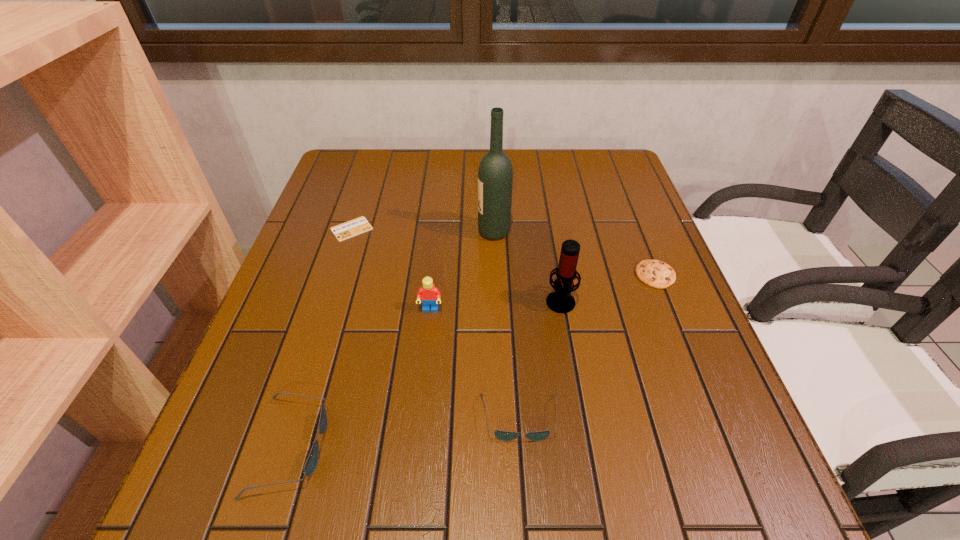
The width and height of the screenshot is (960, 540). What are the coordinates of `the taller sunglasses` in the screenshot? It's located at click(310, 466).

At what (x,y) coordinates should I click in order to perform the action: click on the fourth tallest object. Please return your answer as a coordinate pair (x, y). Looking at the image, I should click on (310, 466).

This screenshot has height=540, width=960. Identify the location of the shorter sunglasses. (505, 436).

You are a GUI agent. You are given a task and a screenshot of the screen. Output one action in this format:
    pyautogui.click(x=<x>, y=<y>)
    Task: Click on the right sunglasses
    
    Given the screenshot: What is the action you would take?
    pyautogui.click(x=505, y=436)

Find the location of a particular element. The image size is (960, 540). the tallest object is located at coordinates (495, 174).

Image resolution: width=960 pixels, height=540 pixels. What are the coordinates of `the shortest object` in the screenshot? It's located at (354, 227).

In order to click on cookie in this screenshot , I will do `click(657, 274)`.

Locate an element on the screen. The height and width of the screenshot is (540, 960). the sixth tallest object is located at coordinates (657, 274).

Identify the location of the second object from right to left. (561, 301).

The image size is (960, 540). I want to click on microphone, so click(561, 301).